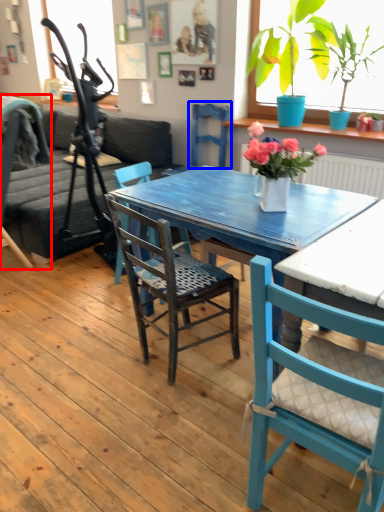
Question: Which object appears farthest to the camera in this image, chair (highlighted by a red box) or armchair (highlighted by a blue box)?

Choices:
 (A) chair
 (B) armchair

Answer: (B)